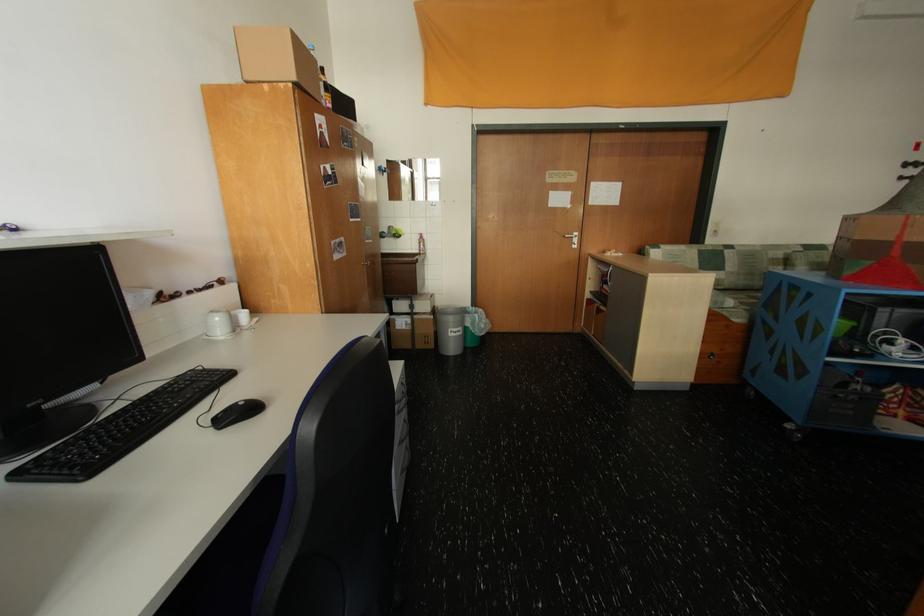
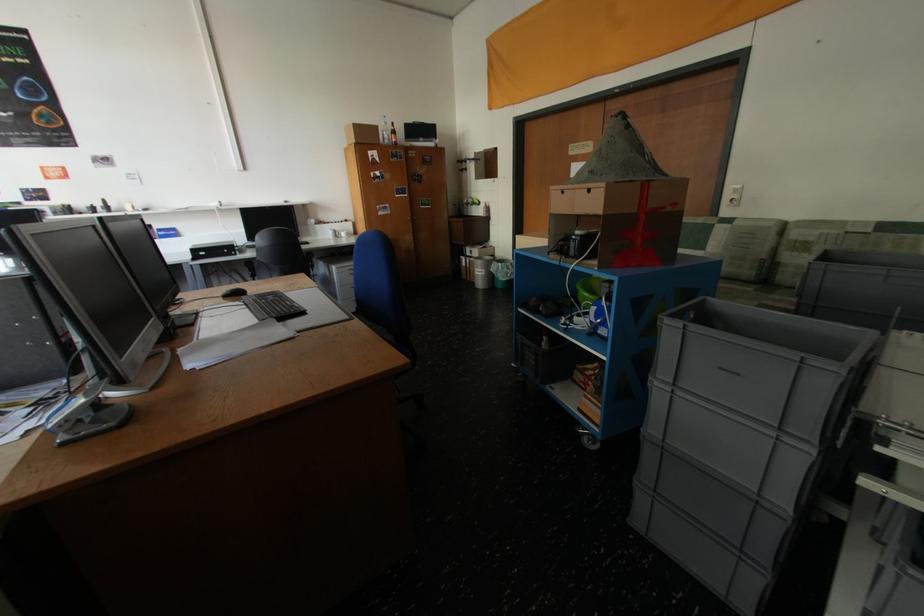
The point at (458, 331) is marked in the first image. Where is the corresponding point in the second image?

(484, 270)